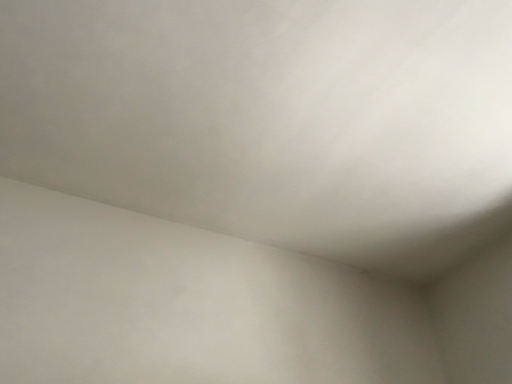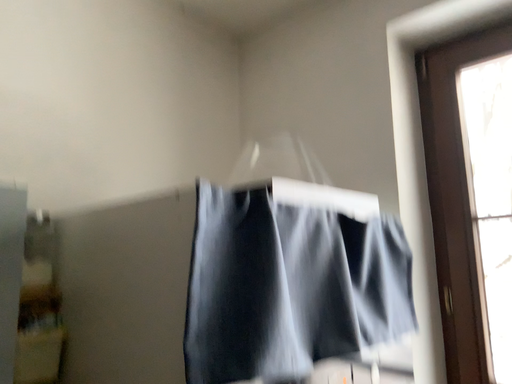
Question: Which way did the camera rotate in the video?

Choices:
 (A) rotated upward
 (B) rotated downward

Answer: (B)